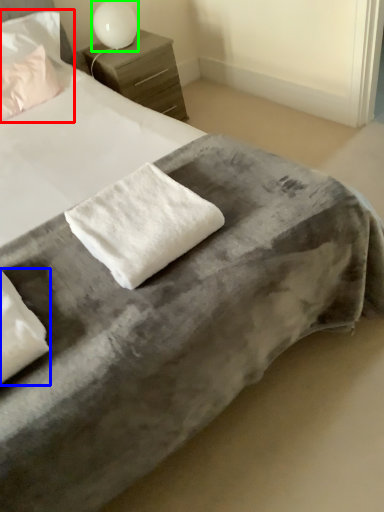
Question: Which object is positioned farthest from pillow (highlighted by a red box)? Select from pillow (highlighted by a blue box) and table lamp (highlighted by a green box).

Choices:
 (A) pillow
 (B) table lamp

Answer: (A)